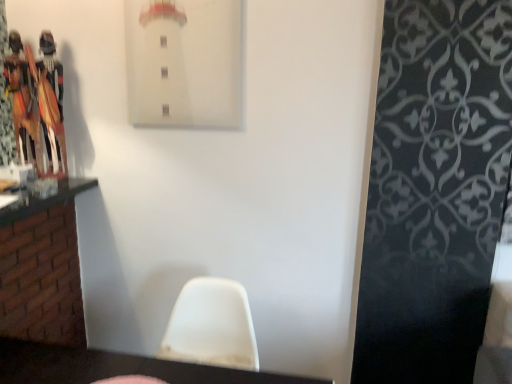
What do you see at coordinates (211, 325) in the screenshot? Image resolution: width=512 pixels, height=384 pixels. I see `white plastic armchair at center` at bounding box center [211, 325].

In order to face white plastic armchair at center, should I rotate leftwards or rightwards?

Turn left by 6.251 degrees to look at white plastic armchair at center.

Locate an element on the screen. Image resolution: width=512 pixels, height=384 pixels. white plastic armchair at center is located at coordinates (211, 325).

Identify the location of white plastic armchair at center. (211, 325).